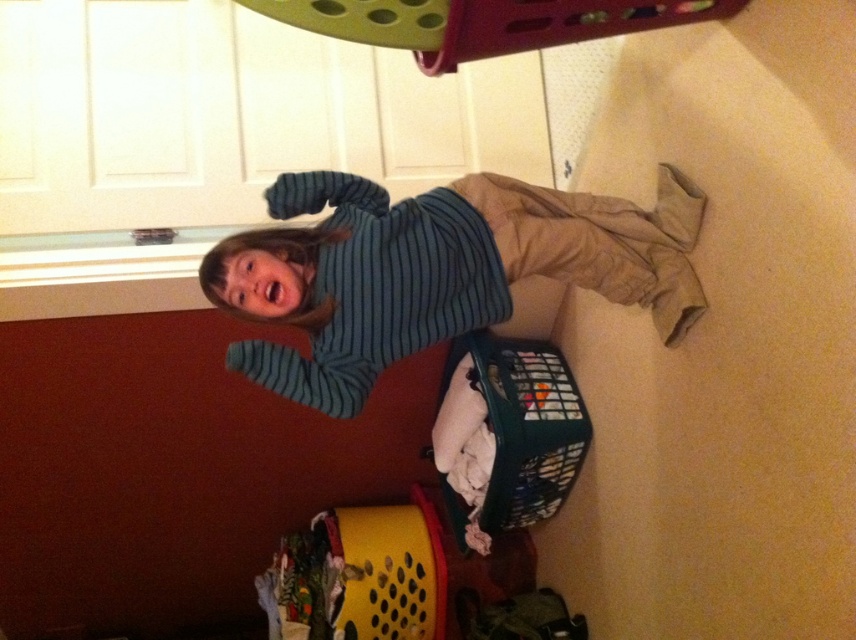
You are organizing your closet and see the striped cotton shirt at center and the plastic laundry basket at lower right. Which item is closer to you?

The striped cotton shirt at center is closer to you because it is in front of the plastic laundry basket at lower right.

You are organizing a closet and need to place the striped cotton shirt at center and the plastic laundry basket at lower right. According to the image, which item is positioned to the left of the other?

The striped cotton shirt at center is to the left of the plastic laundry basket at lower right.

You are helping organize the laundry. The striped cotton shirt at center needs to be folded and placed into the plastic laundry basket at lower right. Will the shirt fit inside the basket?

The striped cotton shirt at center is larger in size than plastic laundry basket at lower right, so the shirt will not fit inside the basket.